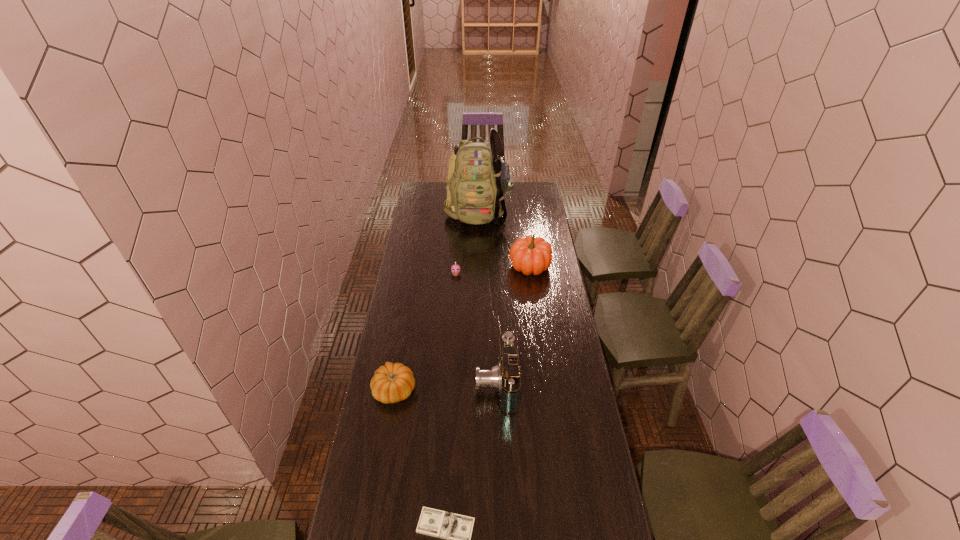
This screenshot has width=960, height=540. Identify the location of blank space located 0.240m on the front-facing side of the camcorder. (415, 383).

Locate an element on the screen. The image size is (960, 540). free space located on the front-facing side of the camcorder is located at coordinates (430, 383).

Locate an element on the screen. This screenshot has height=540, width=960. blank space located 0.160m on the front of the gourd is located at coordinates (385, 449).

Locate an element on the screen. The image size is (960, 540). vacant space situated 0.290m on the face of the second shortest object is located at coordinates (453, 318).

Image resolution: width=960 pixels, height=540 pixels. In order to click on object that is at the far edge in this screenshot , I will do `click(478, 178)`.

Identify the location of object at the left edge. (393, 382).

The width and height of the screenshot is (960, 540). I want to click on object located at the right edge, so click(x=530, y=255).

Locate an element on the screen. The height and width of the screenshot is (540, 960). vacant area at the left edge of the desktop is located at coordinates (416, 316).

Where is `free space at the right edge of the desktop`? Image resolution: width=960 pixels, height=540 pixels. free space at the right edge of the desktop is located at coordinates (551, 285).

At what (x,y) coordinates should I click in order to perform the action: click on free space at the far left corner. Please return your answer as a coordinate pair (x, y). Looking at the image, I should click on (419, 187).